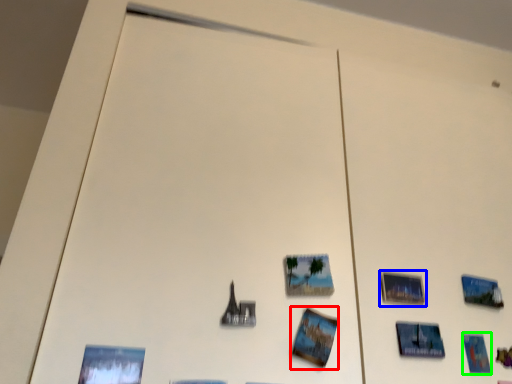
Question: Estimate the real-world distances between objects in this image. Which object is farther from postcard (highlighted by a red box), picture frame (highlighted by a blue box) or postcard (highlighted by a green box)?

Choices:
 (A) picture frame
 (B) postcard

Answer: (B)